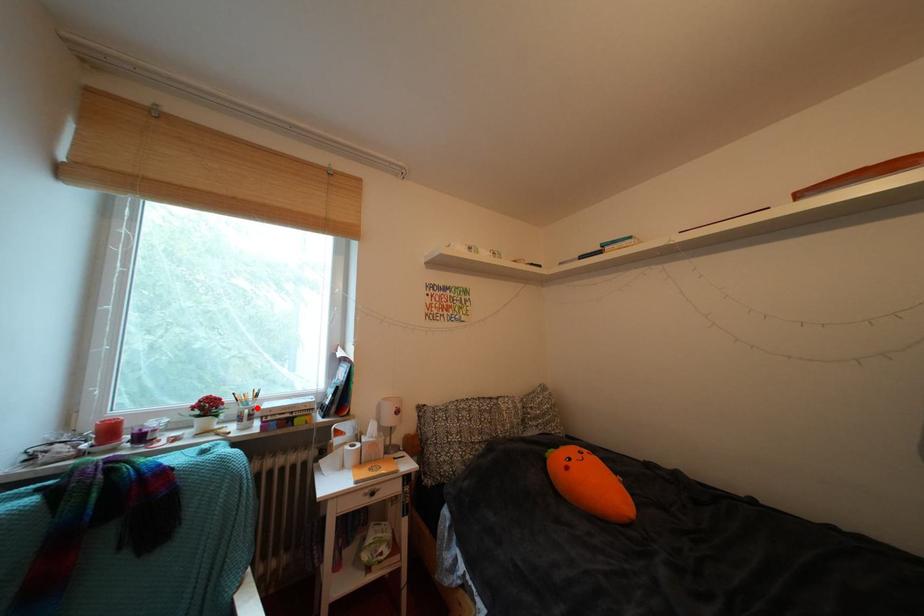
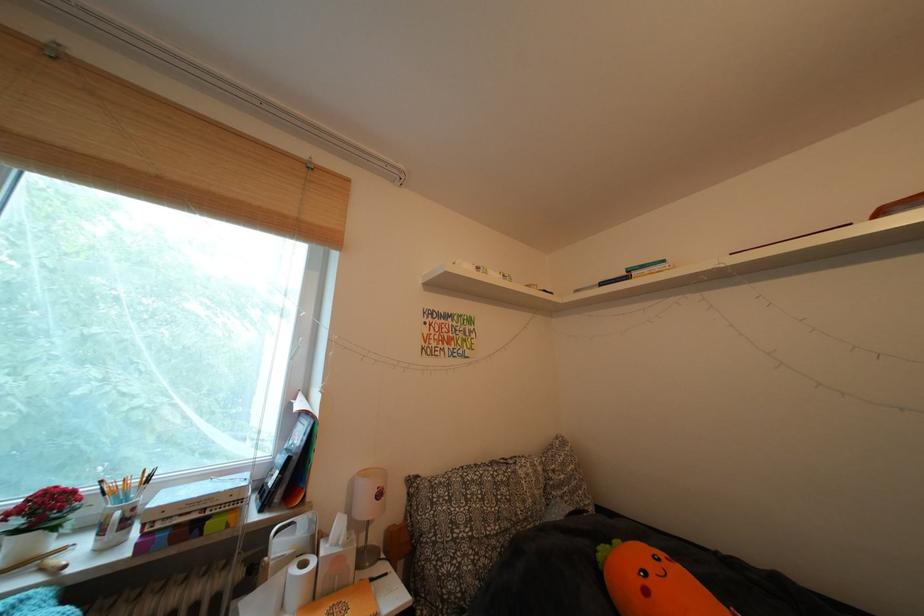
Locate, in the second image, the point that corresponds to the highlighted location in the first image.

(137, 500)